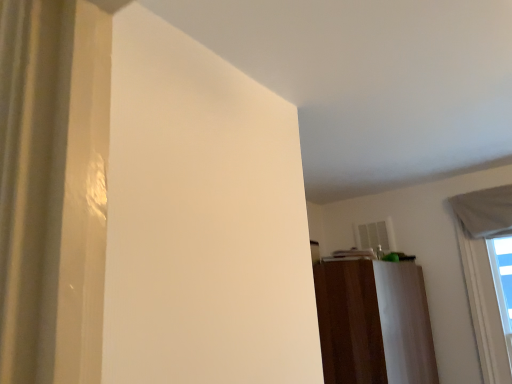
Question: Looking at the image, does white fabric window at upper right seem bigger or smaller compared to brown wood dresser at center?

Choices:
 (A) big
 (B) small

Answer: (B)

Question: Relative to brown wood dresser at center, is white fabric window at upper right in front or behind?

Choices:
 (A) behind
 (B) front

Answer: (A)

Question: From a real-world perspective, relative to brown wood dresser at center, is white fabric window at upper right vertically above or below?

Choices:
 (A) above
 (B) below

Answer: (A)

Question: Considering the positions of brown wood dresser at center and white fabric window at upper right in the image, is brown wood dresser at center bigger or smaller than white fabric window at upper right?

Choices:
 (A) small
 (B) big

Answer: (B)

Question: Considering the positions of brown wood dresser at center and white fabric window at upper right in the image, is brown wood dresser at center wider or thinner than white fabric window at upper right?

Choices:
 (A) wide
 (B) thin

Answer: (A)

Question: Is point (325, 276) closer or farther from the camera than point (459, 248)?

Choices:
 (A) closer
 (B) farther

Answer: (A)

Question: From the image's perspective, relative to white fabric window at upper right, is brown wood dresser at center above or below?

Choices:
 (A) below
 (B) above

Answer: (A)